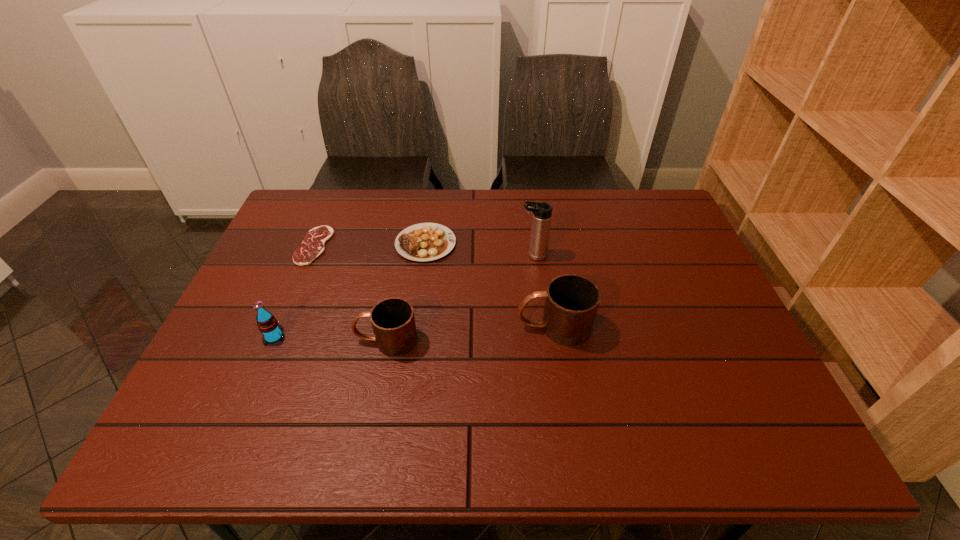
What are the coordinates of `object that ranks as the fifth closest to the taller steak` in the screenshot? It's located at click(x=267, y=324).

Locate which object ranks fifth in proximity to the soda. Please provide its 2D coordinates. Your answer should be formatted as a tuple, i.e. [(x, y)], where the tuple contains the x and y coordinates of a point satisfying the conditions above.

[(542, 212)]

Identify the location of vacant position in the image that satisfies the following two spatial constraints: 1. on the back side of the taller steak; 2. on the right side of the shorter steak. (316, 244).